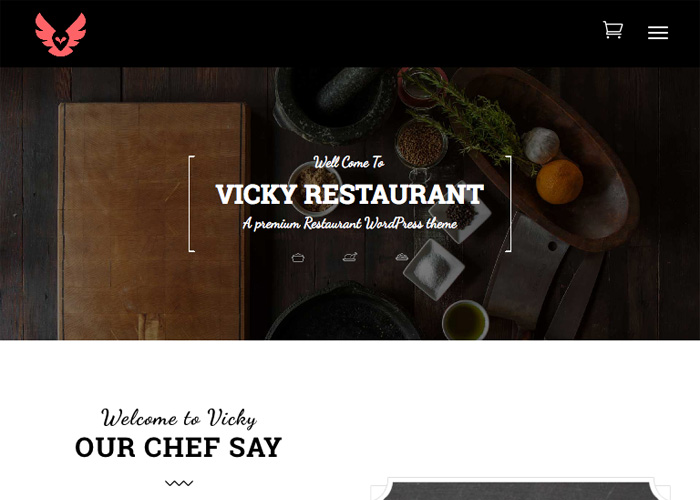
Find the location of `spice grinding bowl`. spice grinding bowl is located at coordinates (327, 91).